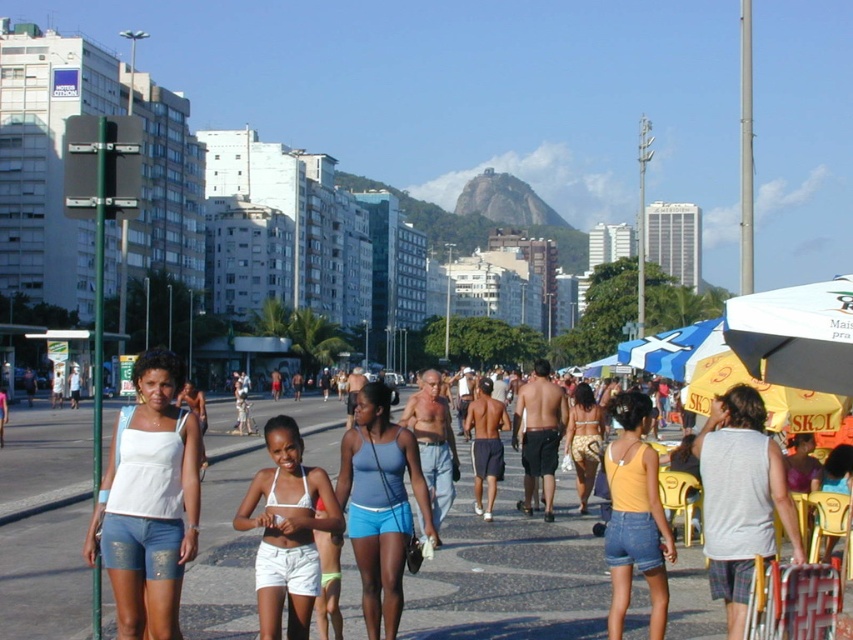
You are a photographer trying to capture a person wearing matte blue shorts at center in the image. The camera you are using has a focal length of 50mm and an aperture of f2.8. The person is standing at point 0.789, 0.447. You want to ensure that the person is in focus while the background remains slightly blurred. What adjustment should you make to the camera settings to achieve this effect?

To achieve a blurred background while keeping the matte blue shorts at center in focus, you can use a wider aperture setting like f2.8, which you already have. This aperture allows more light and creates a shallower depth of field, resulting in the background being out of focus. Ensure the subject is positioned away from the background and maintain the focus on the matte blue shorts at center.